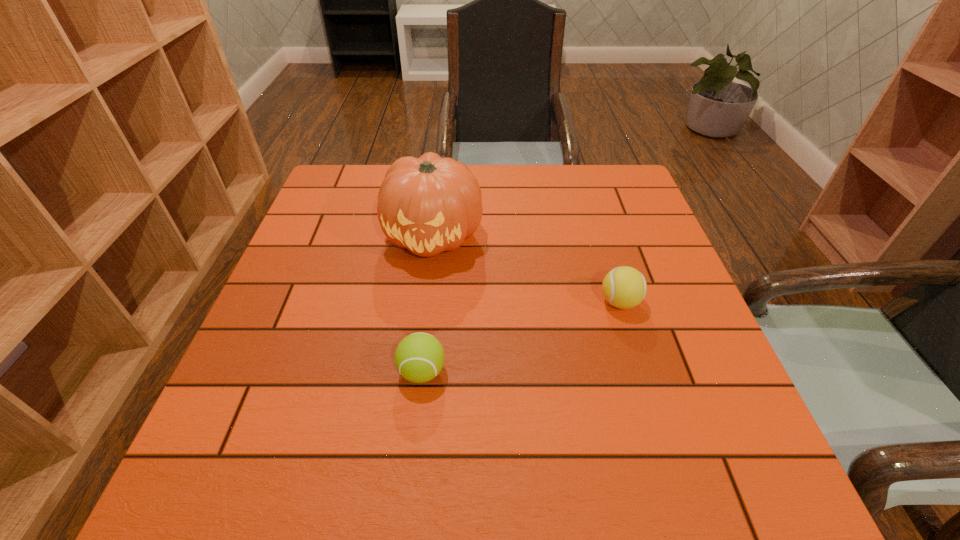
At what (x,y) coordinates should I click in order to perform the action: click on vacant region between the left tennis ball and the farthest object. Please return your answer as a coordinate pair (x, y). The width and height of the screenshot is (960, 540). Looking at the image, I should click on (428, 303).

Identify the location of free space between the tallest object and the right tennis ball. This screenshot has height=540, width=960. (527, 269).

Where is `vacant area that lies between the left tennis ball and the rightmost object`? The width and height of the screenshot is (960, 540). vacant area that lies between the left tennis ball and the rightmost object is located at coordinates (521, 337).

At what (x,y) coordinates should I click in order to perform the action: click on free spot between the nearer tennis ball and the pumpkin. Please return your answer as a coordinate pair (x, y). This screenshot has height=540, width=960. Looking at the image, I should click on (428, 303).

The height and width of the screenshot is (540, 960). In order to click on free spot between the left tennis ball and the farthest object in this screenshot , I will do `click(428, 303)`.

I want to click on empty space between the rightmost object and the nearer tennis ball, so coord(521,337).

Find the location of a particular element. This screenshot has height=540, width=960. vacant area that lies between the farthest object and the left tennis ball is located at coordinates (428, 303).

Identify the location of object identified as the closest to the nearest object. The width and height of the screenshot is (960, 540). (430, 204).

This screenshot has width=960, height=540. What are the coordinates of `object that can be found as the second closest to the left tennis ball` in the screenshot? It's located at (624, 287).

Where is `vacant space that satisfies the following two spatial constraints: 1. on the carved face of the tallest object; 2. on the right side of the nearest object`? The height and width of the screenshot is (540, 960). vacant space that satisfies the following two spatial constraints: 1. on the carved face of the tallest object; 2. on the right side of the nearest object is located at coordinates tap(418, 372).